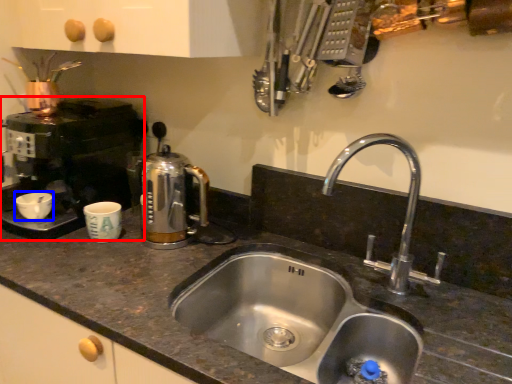
Question: Which of the following is the farthest to the observer, coffee machine (highlighted by a red box) or basin (highlighted by a blue box)?

Choices:
 (A) coffee machine
 (B) basin

Answer: (B)